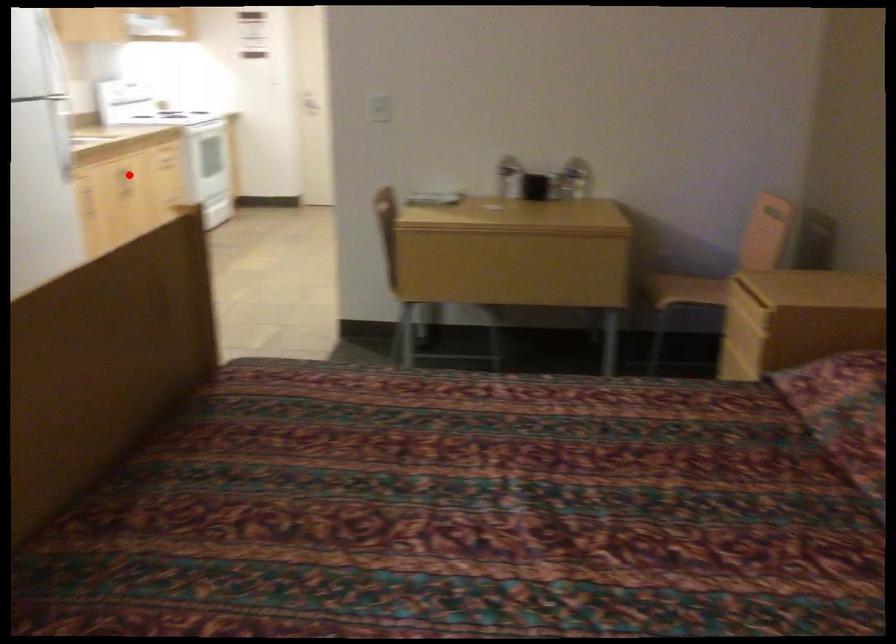
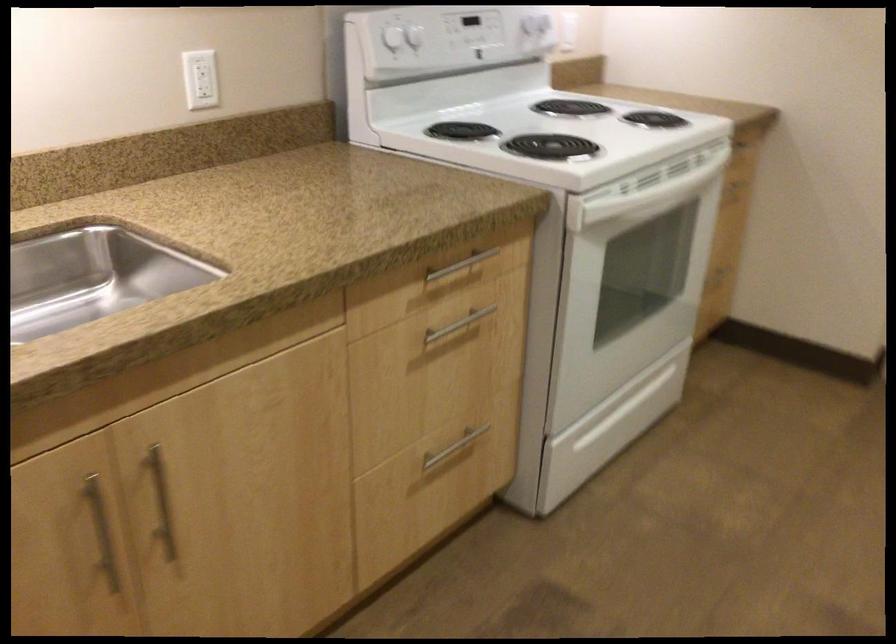
Question: I am providing you with two images of the same scene from different viewpoints. In image1, a red point is highlighted. Considering the same 3D point in image2, which of the following is correct?

Choices:
 (A) It is closer
 (B) It is farther

Answer: (A)